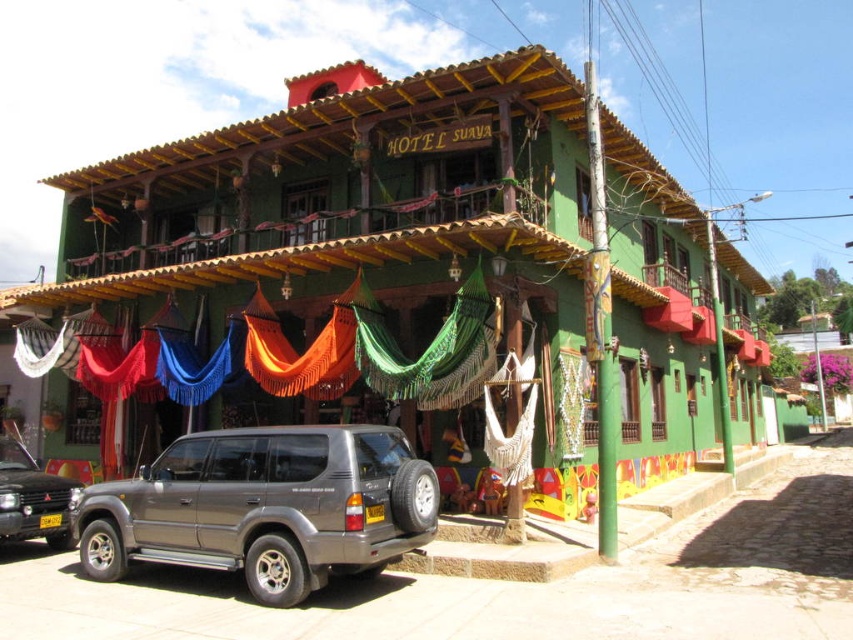
Question: Does green woven hammocks at center have a smaller size compared to metallic gray suv at lower left?

Choices:
 (A) no
 (B) yes

Answer: (A)

Question: Can you confirm if green woven hammocks at center is wider than metallic gray suv at center?

Choices:
 (A) no
 (B) yes

Answer: (B)

Question: Which point is closer to the camera taking this photo?

Choices:
 (A) tap(445, 150)
 (B) tap(20, 481)

Answer: (B)

Question: Does green woven hammocks at center appear over metallic gray suv at center?

Choices:
 (A) no
 (B) yes

Answer: (B)

Question: Among these points, which one is nearest to the camera?

Choices:
 (A) (62, 499)
 (B) (358, 554)

Answer: (B)

Question: Which point appears farthest from the camera in this image?

Choices:
 (A) (606, 216)
 (B) (55, 506)
 (C) (412, 486)

Answer: (B)